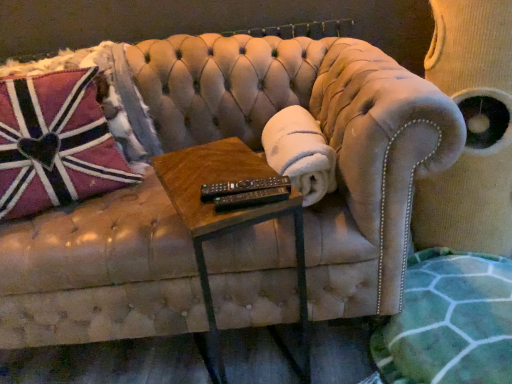
Question: From a real-world perspective, is velvet swivel chair at upper right above or below pink plush pillow at left?

Choices:
 (A) above
 (B) below

Answer: (B)

Question: From the image's perspective, is velvet swivel chair at upper right located above or below pink plush pillow at left?

Choices:
 (A) below
 (B) above

Answer: (A)

Question: Which of these objects is positioned farthest from the green textured blanket at lower right?

Choices:
 (A) black plastic remote at center
 (B) woodenmaterial/texturetable at center
 (C) velvet swivel chair at upper right
 (D) black plastic remote at center
 (E) pink plush pillow at left

Answer: (E)

Question: Estimate the real-world distances between objects in this image. Which object is farther from the black plastic remote at center?

Choices:
 (A) velvet swivel chair at upper right
 (B) black plastic remote at center
 (C) white fluffy blanket at center
 (D) green textured blanket at lower right
 (E) pink plush pillow at left

Answer: (A)